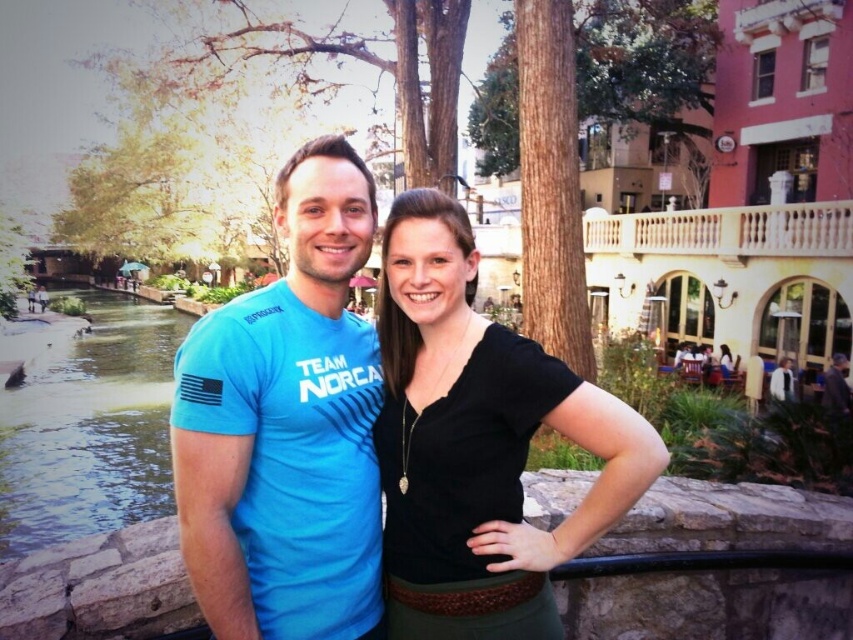
What is the exact coordinate of the black matte shirt at center?

The black matte shirt at center is located at point (479, 444).

You are a photographer standing at the center of the scene. You want to take a photo that includes both the man on the left and the woman on the right. However, you notice two points marked in the scene at coordinates point (x=276, y=573) and point (x=618, y=452). Which of these points is closer to your camera position?

Point (x=276, y=573) is further to the camera than point (x=618, y=452), so the point that is closer to the camera is point (x=618, y=452).

Where is the blue fabric shirt at center located in the image?

The blue fabric shirt at center is located at point 0.667 on the horizontal axis and point 0.336 on the vertical axis.